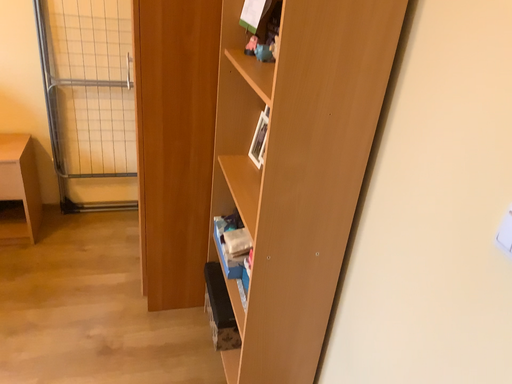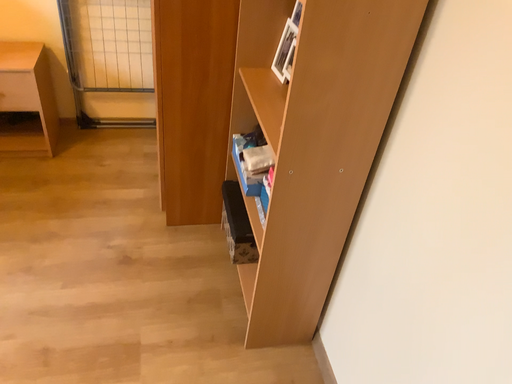
Question: How did the camera likely rotate when shooting the video?

Choices:
 (A) rotated upward
 (B) rotated downward

Answer: (B)